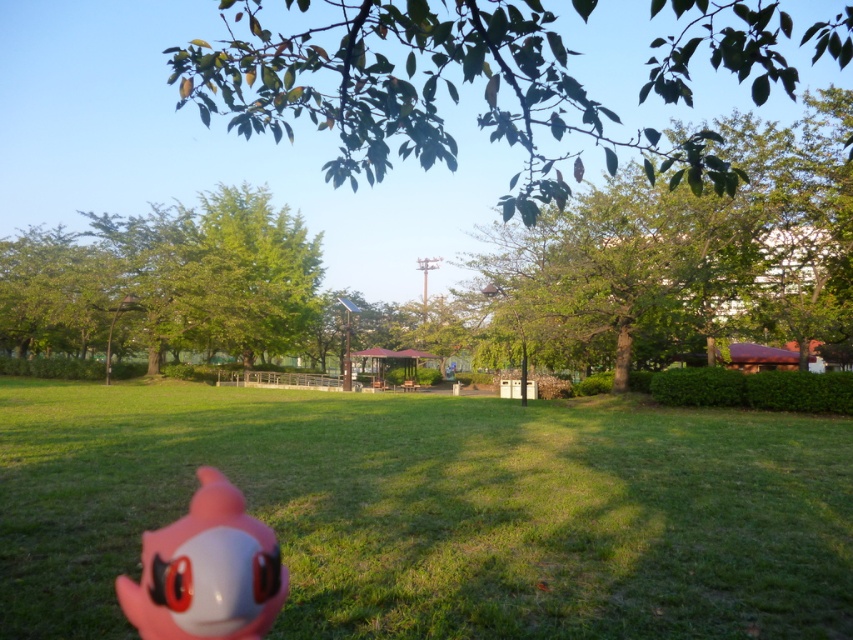
Is green leafy tree at center wider than pink rubber toy at lower left?

Yes, green leafy tree at center is wider than pink rubber toy at lower left.

Is green leafy tree at center closer to camera compared to pink rubber toy at lower left?

No, it is not.

Is point (229, 240) farther from viewer compared to point (206, 560)?

Yes, point (229, 240) is behind point (206, 560).

At what (x,y) coordinates should I click in order to perform the action: click on green leafy tree at center. Please return your answer as a coordinate pair (x, y). The width and height of the screenshot is (853, 640). Looking at the image, I should click on (165, 282).

Does pink rubber toy at center appear on the right side of green leafy tree at upper right?

No, pink rubber toy at center is not to the right of green leafy tree at upper right.

Is pink rubber toy at center thinner than green leafy tree at upper right?

No, pink rubber toy at center is not thinner than green leafy tree at upper right.

Find the location of a particular element. Image resolution: width=853 pixels, height=640 pixels. pink rubber toy at center is located at coordinates (437, 509).

Who is taller, green glossy leaves at upper center or green leafy tree at upper right?

Standing taller between the two is green glossy leaves at upper center.

Is green glossy leaves at upper center above green leafy tree at upper right?

Yes, green glossy leaves at upper center is above green leafy tree at upper right.

I want to click on green glossy leaves at upper center, so click(x=425, y=92).